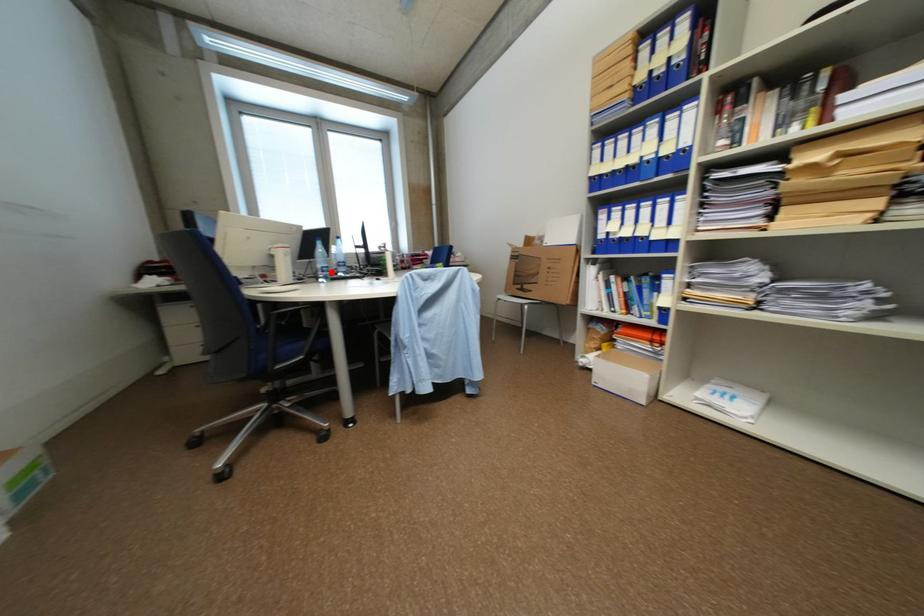
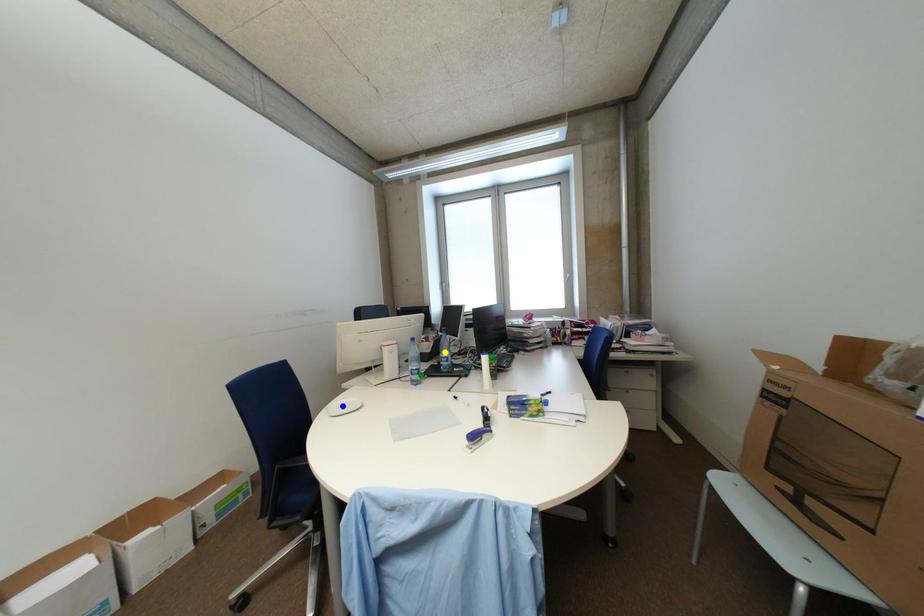
Question: I am providing you with two images of the same scene from different viewpoints. A red point is marked on the first image. You are given multiple points on the second image. Can you choose the point in image 2 that corresponds to the point in image 1?

Choices:
 (A) yellow point
 (B) blue point
 (C) green point

Answer: (C)